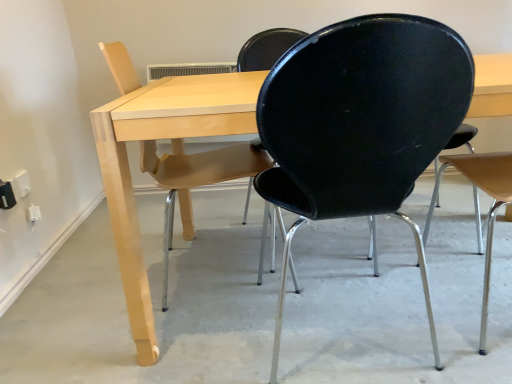
Where is `vacant space behind black matte chair at right, acting as the 3th chair starting from the left`? The width and height of the screenshot is (512, 384). vacant space behind black matte chair at right, acting as the 3th chair starting from the left is located at coordinates (425, 251).